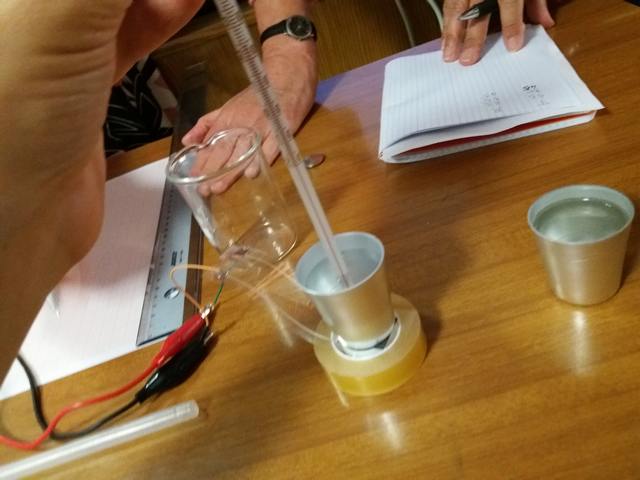
The height and width of the screenshot is (480, 640). What are the coordinates of `pen for writing` in the screenshot? It's located at (488, 6).